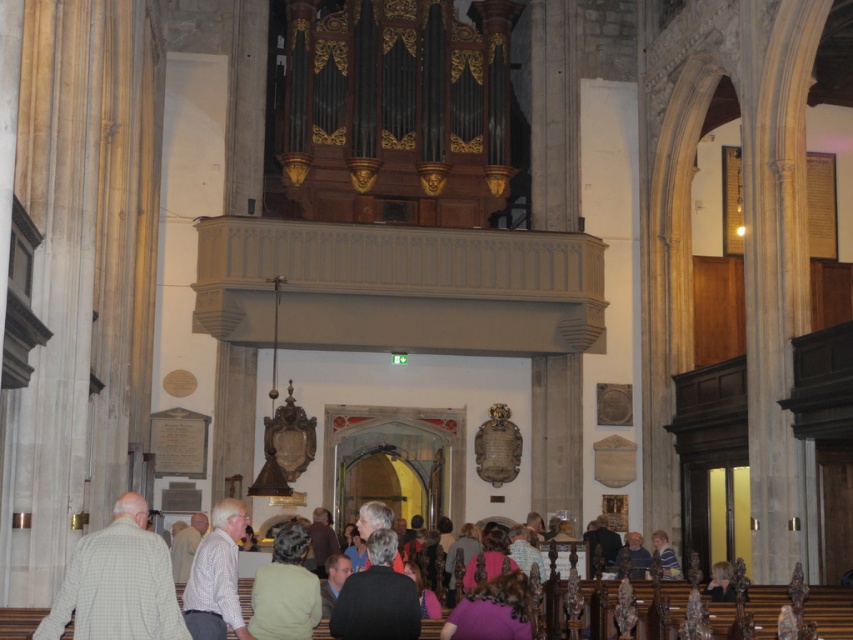
Does checkered shirt at center have a lesser height compared to light brown leather jacket at lower center?

No, checkered shirt at center is not shorter than light brown leather jacket at lower center.

Which is below, checkered shirt at center or light brown leather jacket at lower center?

light brown leather jacket at lower center is below.

Is point (225, 525) in front of point (633, 560)?

Yes, it is in front of point (633, 560).

At what (x,y) coordinates should I click in order to perform the action: click on checkered shirt at center. Please return your answer as a coordinate pair (x, y). The image size is (853, 640). Looking at the image, I should click on (216, 577).

Can you confirm if light gray checkered shirt at lower left is thinner than checkered shirt at center?

Yes.

You are a GUI agent. You are given a task and a screenshot of the screen. Output one action in this format:
    pyautogui.click(x=<x>, y=<y>)
    Task: Click on the light gray checkered shirt at lower left
    The image size is (853, 640).
    Given the screenshot: What is the action you would take?
    pyautogui.click(x=119, y=582)

Does point (86, 541) lie in front of point (245, 636)?

Yes, it is.

Where is `light gray checkered shirt at lower left`? This screenshot has height=640, width=853. light gray checkered shirt at lower left is located at coordinates (119, 582).

Can you confirm if light gray checkered shirt at lower left is taller than dark gray sweater at lower center?

Indeed, light gray checkered shirt at lower left has a greater height compared to dark gray sweater at lower center.

Can you confirm if light gray checkered shirt at lower left is positioned to the right of dark gray sweater at lower center?

Incorrect, light gray checkered shirt at lower left is not on the right side of dark gray sweater at lower center.

Locate an element on the screen. The height and width of the screenshot is (640, 853). light gray checkered shirt at lower left is located at coordinates [119, 582].